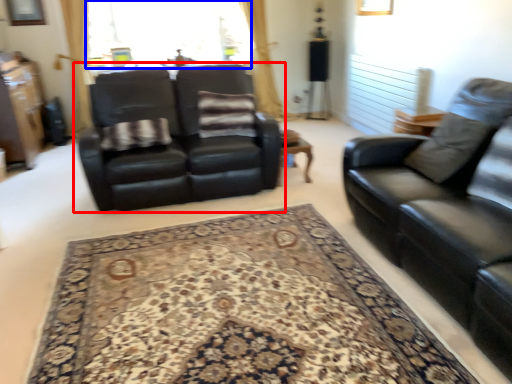
Question: Which object is closer to the camera taking this photo, studio couch (highlighted by a red box) or window screen (highlighted by a blue box)?

Choices:
 (A) studio couch
 (B) window screen

Answer: (A)